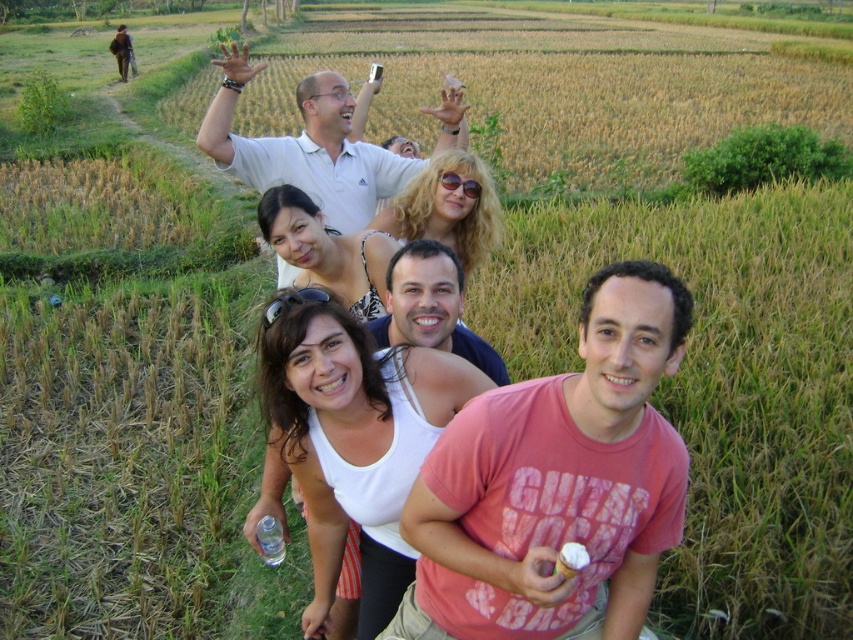
Question: Can you confirm if pink cotton t-shirt at center is positioned below white cotton shirt at center?

Choices:
 (A) no
 (B) yes

Answer: (B)

Question: Does pink cotton t-shirt at center appear on the left side of white matte shirt at upper center?

Choices:
 (A) yes
 (B) no

Answer: (B)

Question: Which point is closer to the camera?

Choices:
 (A) pink cotton t-shirt at center
 (B) white cotton shirt at center

Answer: (A)

Question: Among these objects, which one is farthest from the camera?

Choices:
 (A) white cotton shirt at center
 (B) white matte shirt at upper center
 (C) pink cotton t-shirt at center

Answer: (B)

Question: Considering the real-world distances, which object is closest to the white matte shirt at upper center?

Choices:
 (A) white cotton shirt at center
 (B) pink cotton t-shirt at center

Answer: (B)

Question: Observing the image, what is the correct spatial positioning of pink cotton t-shirt at center in reference to white cotton shirt at center?

Choices:
 (A) above
 (B) below

Answer: (B)